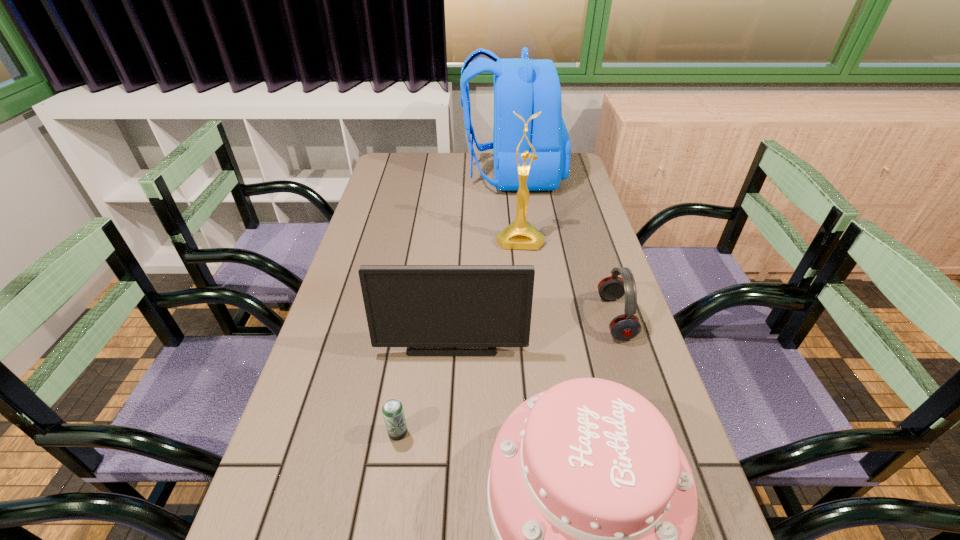
Identify the location of vacant space located 0.060m on the ear cups of the fifth tallest object. (578, 318).

At what (x,y) coordinates should I click in order to perform the action: click on free location located on the ear cups of the fifth tallest object. Please return your answer as a coordinate pair (x, y). This screenshot has height=540, width=960. Looking at the image, I should click on (496, 318).

The width and height of the screenshot is (960, 540). I want to click on vacant space located on the ear cups of the fifth tallest object, so click(x=512, y=318).

I want to click on vacant area situated 0.260m on the right of the shortest object, so click(536, 433).

You are a GUI agent. You are given a task and a screenshot of the screen. Output one action in this format:
    pyautogui.click(x=<x>, y=<y>)
    Task: Click on the object located at the far edge
    The image size is (960, 540).
    Given the screenshot: What is the action you would take?
    pyautogui.click(x=526, y=86)

Find the location of `object situated at the left edge`. object situated at the left edge is located at coordinates (410, 306).

Image resolution: width=960 pixels, height=540 pixels. I want to click on backpack that is positioned at the right edge, so click(526, 86).

At what (x,y) coordinates should I click in order to perform the action: click on earphone at the right edge. Please return your answer as a coordinate pair (x, y). Image resolution: width=960 pixels, height=540 pixels. Looking at the image, I should click on (627, 326).

Where is `object positioned at the far right corner`? Image resolution: width=960 pixels, height=540 pixels. object positioned at the far right corner is located at coordinates (526, 86).

Locate an element on the screen. The width and height of the screenshot is (960, 540). free spot at the far edge of the desktop is located at coordinates (468, 161).